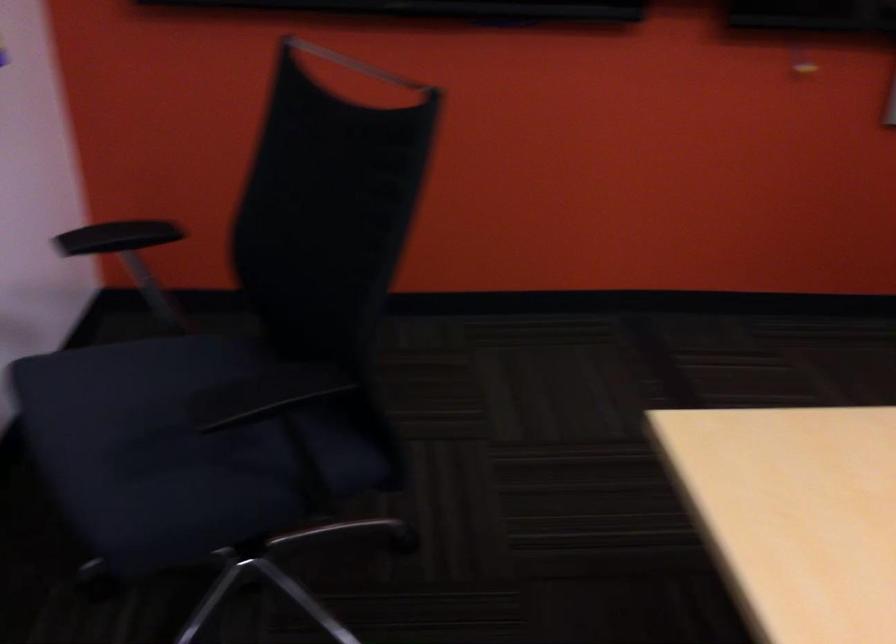
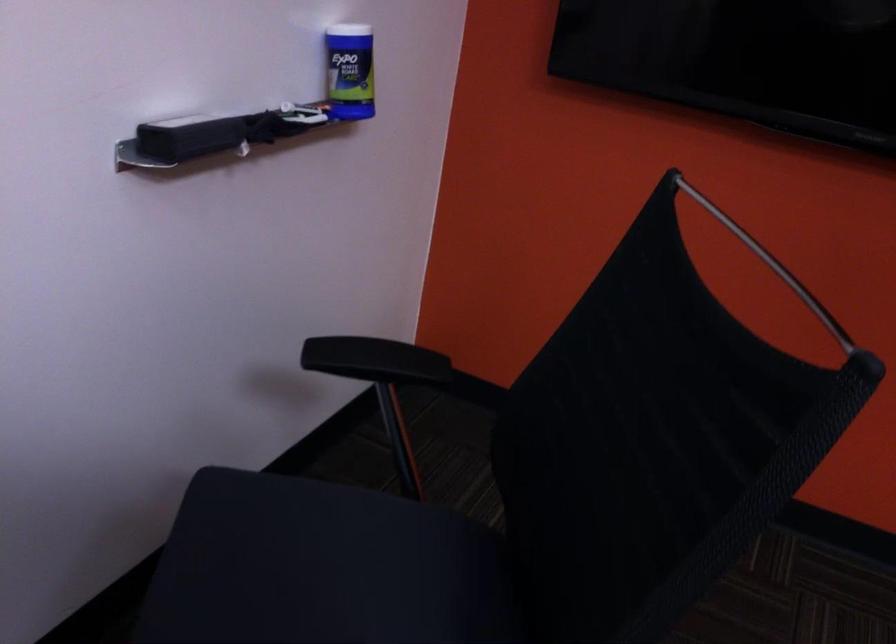
Question: The camera is either moving clockwise (left) or counter-clockwise (right) around the object. The first image is from the beginning of the video and the second image is from the end. Is the camera moving left or right when shooting the video?

Choices:
 (A) Left
 (B) Right

Answer: (B)